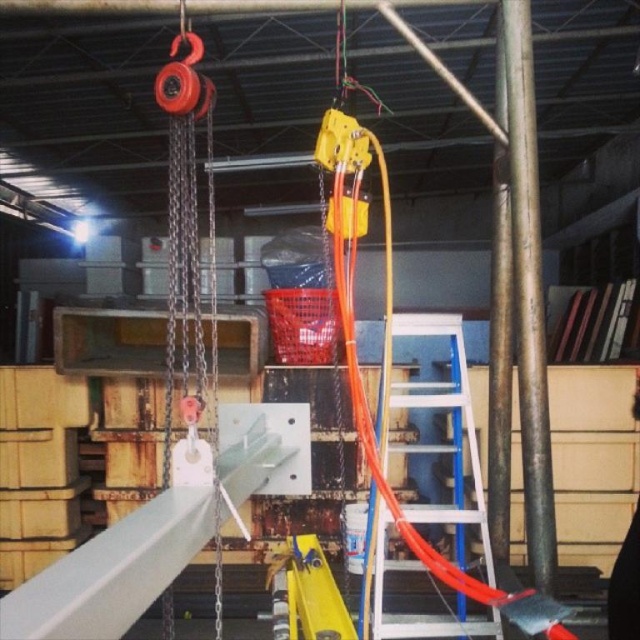
Is metallic pole at center-right behind white plastic ladder at center?

Yes.

Between point (522, 346) and point (378, 401), which one is positioned behind?

Positioned behind is point (378, 401).

Find the location of `metallic pole at center-right`. metallic pole at center-right is located at coordinates (529, 294).

Find the location of a particular element. The width and height of the screenshot is (640, 640). metallic pole at center-right is located at coordinates (529, 294).